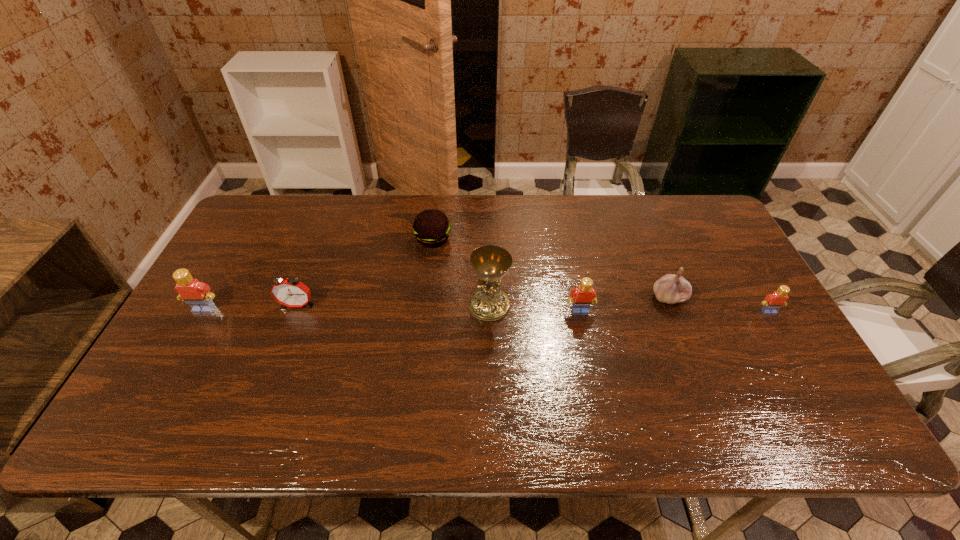
To achieve uniform spacing by inserting another Lego among them, please point to a free space for this new Lego. Please provide its 2D coordinates. Your answer should be formatted as a tuple, i.e. [(x, y)], where the tuple contains the x and y coordinates of a point satisfying the conditions above.

[(392, 310)]